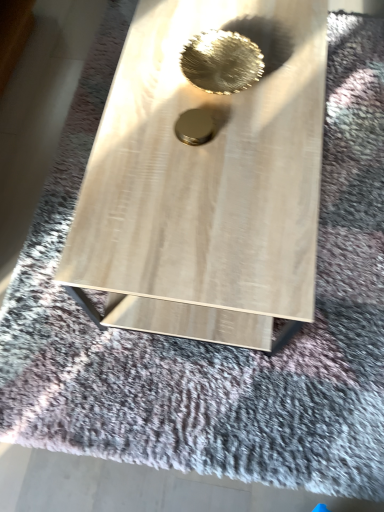
Locate an element on the screen. unoccupied area in front of gold metallic circle at center, arranged as the first hole when ordered from the bottom is located at coordinates (199, 187).